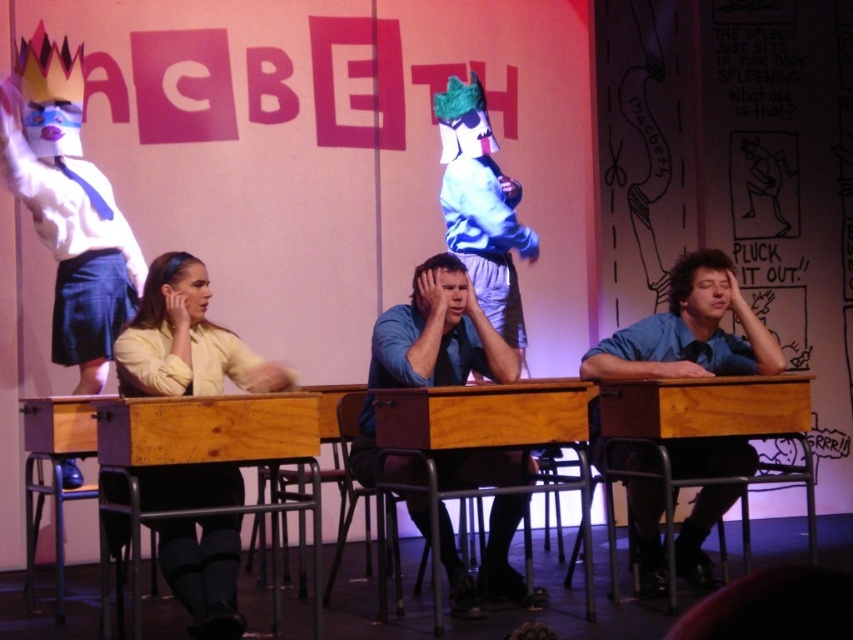
Locate an element on the screen. blue shirt at right is located at coordinates (689, 332).

Does point (688, 340) come farther from viewer compared to point (436, 385)?

Yes, point (688, 340) is behind point (436, 385).

Locate an element on the screen. blue shirt at right is located at coordinates (689, 332).

Locate an element on the screen. The image size is (853, 640). blue shirt at right is located at coordinates (689, 332).

Consider the image. Between yellow shirt at center and blue shirt at right, which one has less height?

With less height is yellow shirt at center.

Is point (194, 579) positioned before point (764, 364)?

That is True.

Between point (196, 632) and point (640, 540), which one is positioned behind?

Positioned behind is point (640, 540).

In order to click on yellow shirt at center in this screenshot , I will do `click(184, 340)`.

Between point (189, 282) and point (389, 332), which one is positioned behind?

The point (389, 332) is more distant.

Is yellow shirt at center wider than blue shirt at center?

In fact, yellow shirt at center might be narrower than blue shirt at center.

Does point (157, 381) come behind point (471, 321)?

That is False.

You are a GUI agent. You are given a task and a screenshot of the screen. Output one action in this format:
    pyautogui.click(x=<x>, y=<y>)
    Task: Click on the yellow shirt at center
    This screenshot has width=853, height=640.
    Given the screenshot: What is the action you would take?
    pyautogui.click(x=184, y=340)